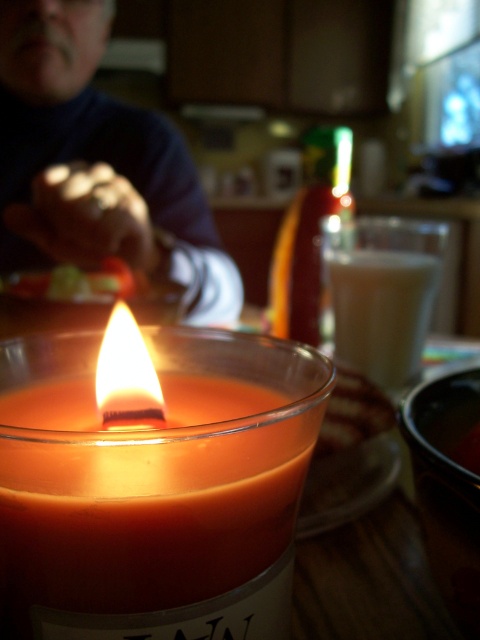
Question: Which of these objects is positioned closest to the translucent glass candle at center?

Choices:
 (A) smokey orange wax candle at center
 (B) blue sweater at upper left

Answer: (A)

Question: Which point is closer to the camera?

Choices:
 (A) [x=91, y=141]
 (B) [x=196, y=592]
 (C) [x=379, y=243]

Answer: (B)

Question: Is smokey orange wax candle at center to the right of blue sweater at upper left from the viewer's perspective?

Choices:
 (A) no
 (B) yes

Answer: (B)

Question: Which point is closer to the camera?

Choices:
 (A) smokey orange wax candle at center
 (B) blue sweater at upper left

Answer: (A)

Question: Does blue sweater at upper left have a smaller size compared to translucent glass candle at center?

Choices:
 (A) yes
 (B) no

Answer: (B)

Question: Does blue sweater at upper left have a lesser width compared to translucent glass candle at center?

Choices:
 (A) yes
 (B) no

Answer: (B)